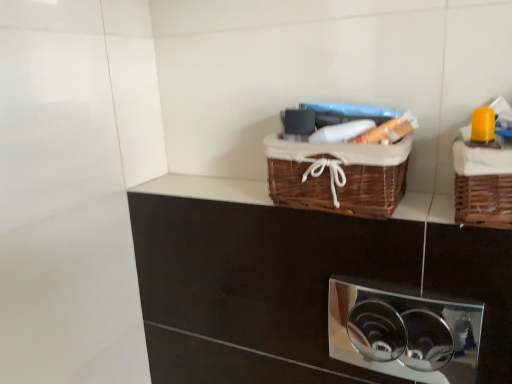
What do you see at coordinates (338, 176) in the screenshot? The width and height of the screenshot is (512, 384). I see `woven brown basket at upper center` at bounding box center [338, 176].

The image size is (512, 384). In order to click on woven brown basket at upper center in this screenshot , I will do `click(338, 176)`.

You are a GUI agent. You are given a task and a screenshot of the screen. Output one action in this format:
    pyautogui.click(x=<x>, y=<y>)
    Task: Click on the woven brown basket at upper center
    
    Given the screenshot: What is the action you would take?
    pyautogui.click(x=338, y=176)